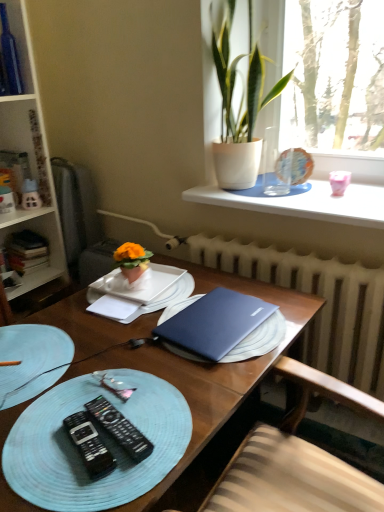
Where is `free point in front of matte orange flowerpot at center, which is the second houseplant in top-to-bottom order`? free point in front of matte orange flowerpot at center, which is the second houseplant in top-to-bottom order is located at coordinates (132, 302).